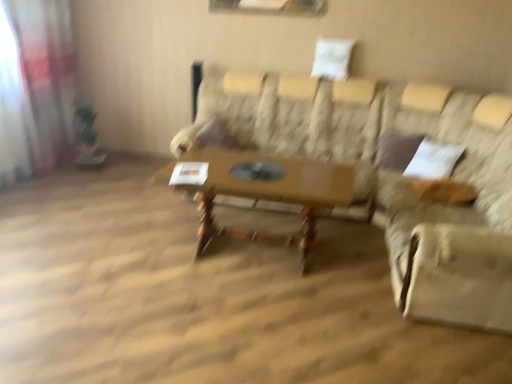
The width and height of the screenshot is (512, 384). I want to click on free space above wooden table at center (from a real-world perspective), so click(x=262, y=168).